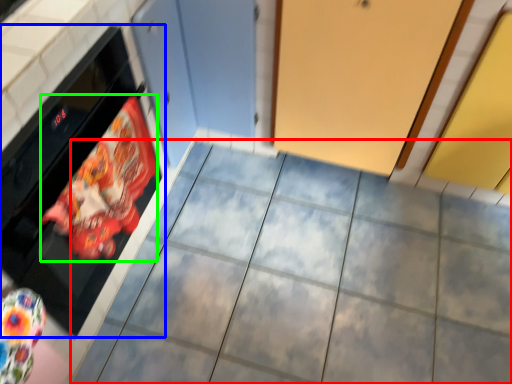
Question: Which is nearer to the ceramic tile (highlighted by a red box)? oven (highlighted by a blue box) or material (highlighted by a green box).

Choices:
 (A) oven
 (B) material

Answer: (B)